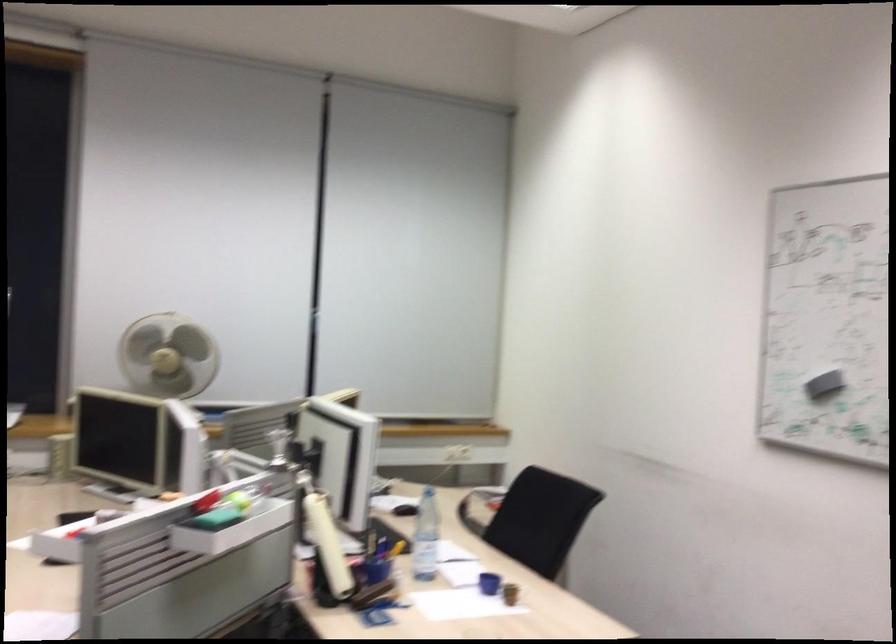
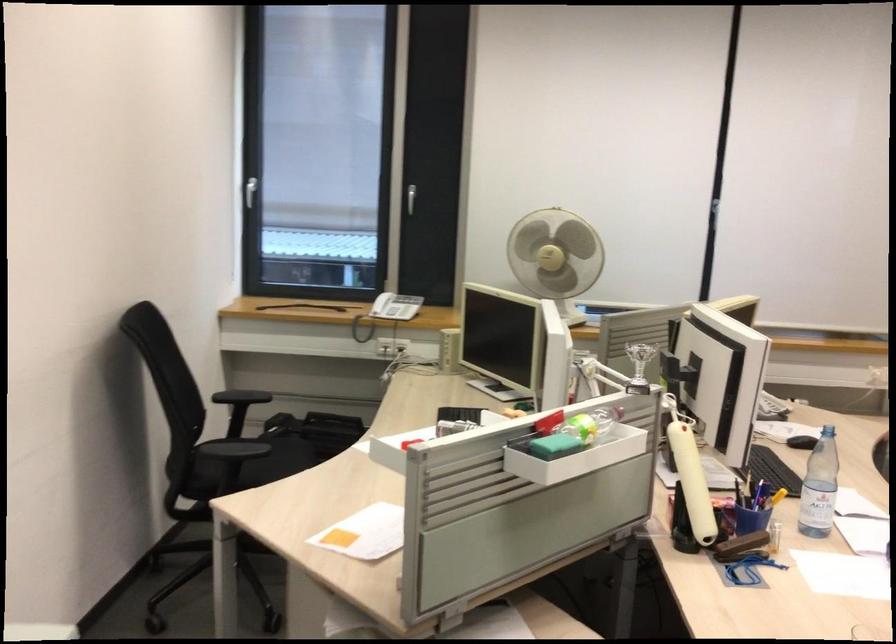
Locate, in the second image, the point that corresponds to (x=211, y=526) in the first image.

(554, 446)